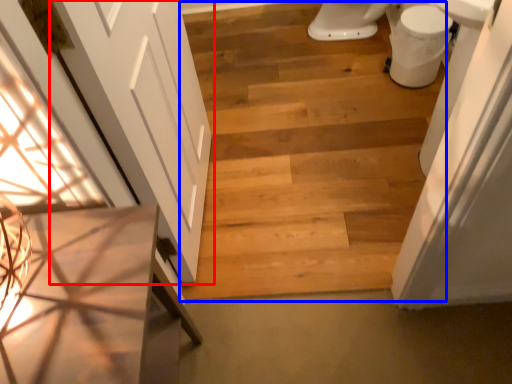
Question: Which point is further to the camera, door (highlighted by a red box) or stairwell (highlighted by a blue box)?

Choices:
 (A) door
 (B) stairwell

Answer: (B)